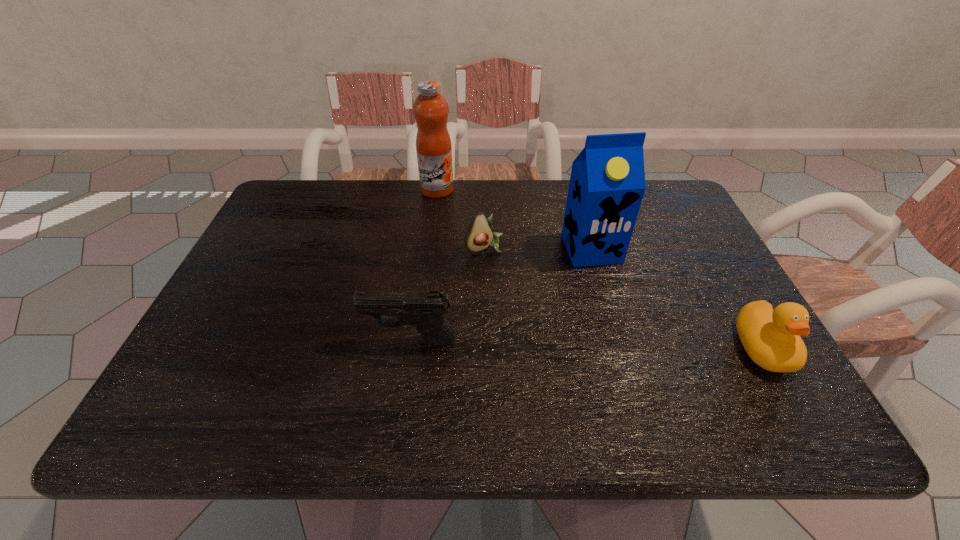
Locate an element on the screen. pistol is located at coordinates (425, 310).

At what (x,y) coordinates should I click in order to perform the action: click on the rightmost object. Please return your answer as a coordinate pair (x, y). The height and width of the screenshot is (540, 960). Looking at the image, I should click on pos(771,338).

I want to click on the farthest object, so click(430, 109).

Image resolution: width=960 pixels, height=540 pixels. In order to click on carton in this screenshot , I will do `click(607, 183)`.

The image size is (960, 540). I want to click on avocado, so (x=479, y=236).

Identify the location of vacant region located 0.220m at the barrel of the pistol. The height and width of the screenshot is (540, 960). (265, 340).

Where is `free location located 0.240m at the barrel of the pistol`? free location located 0.240m at the barrel of the pistol is located at coordinates (256, 340).

At what (x,y) coordinates should I click in order to perform the action: click on free space located 0.170m at the barrel of the pistol. Please return your answer as a coordinate pair (x, y). The width and height of the screenshot is (960, 540). Looking at the image, I should click on (288, 340).

This screenshot has height=540, width=960. In order to click on free space located on the front label of the farthest object in this screenshot , I will do `click(468, 237)`.

Identify the location of free region located on the front label of the farthest object. This screenshot has width=960, height=540. (462, 227).